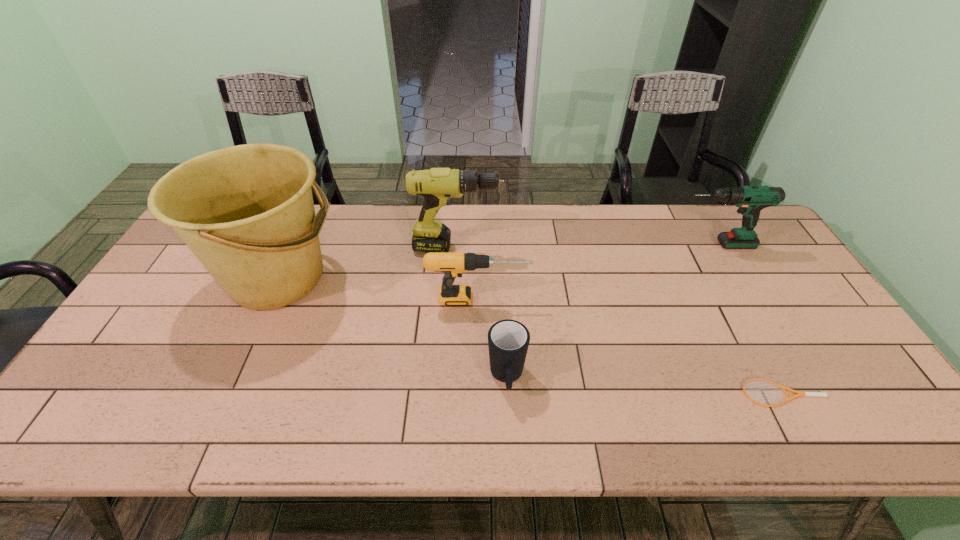
Locate an element on the screen. bucket is located at coordinates (247, 213).

Where is `the tallest object`? The width and height of the screenshot is (960, 540). the tallest object is located at coordinates (247, 213).

Locate an element on the screen. the tallest drill is located at coordinates (438, 186).

Locate an element on the screen. This screenshot has width=960, height=540. the rightmost drill is located at coordinates (751, 200).

The height and width of the screenshot is (540, 960). I want to click on the fourth shortest object, so click(x=751, y=200).

The image size is (960, 540). In order to click on the third shortest object in this screenshot , I will do point(453,264).

Where is `the shortest drill`? Image resolution: width=960 pixels, height=540 pixels. the shortest drill is located at coordinates (453, 264).

Find the location of a particular element. This screenshot has height=540, width=960. the second shortest object is located at coordinates (508, 340).

Where is `the shortest object`? the shortest object is located at coordinates (783, 388).

Where is `vacant space located on the side of the tallest object with the handle`? This screenshot has height=540, width=960. vacant space located on the side of the tallest object with the handle is located at coordinates (363, 278).